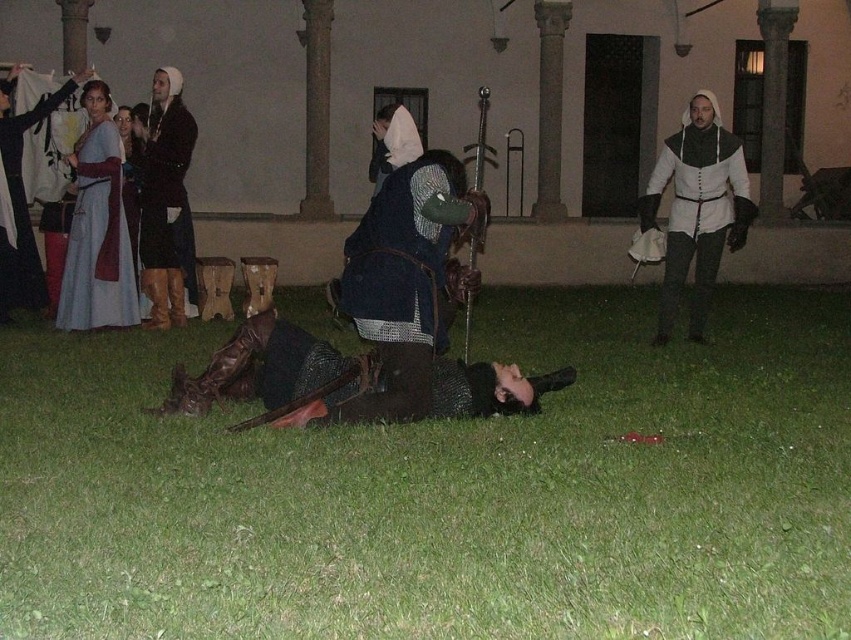
Who is positioned more to the left, white matte armor at center or matte black dress at upper left?

matte black dress at upper left is more to the left.

Is white matte armor at center taller than matte black dress at upper left?

No.

Who is more forward, (701, 276) or (20, 204)?

Point (701, 276) is in front.

Where is `white matte armor at center`? Image resolution: width=851 pixels, height=640 pixels. white matte armor at center is located at coordinates (697, 209).

The image size is (851, 640). What do you see at coordinates (96, 227) in the screenshot?
I see `matte blue dress at upper left` at bounding box center [96, 227].

Can you confirm if matte blue dress at upper left is bigger than matte black tunic at upper left?

Yes.

The image size is (851, 640). Describe the element at coordinates (96, 227) in the screenshot. I see `matte blue dress at upper left` at that location.

Locate an element on the screen. matte blue dress at upper left is located at coordinates click(x=96, y=227).

Is point (196, 381) more distant than point (426, 339)?

Yes, point (196, 381) is behind point (426, 339).

The image size is (851, 640). What do you see at coordinates (351, 380) in the screenshot?
I see `metallic chainmail helmet at center` at bounding box center [351, 380].

Is point (261, 323) more distant than point (374, 262)?

Yes, it is behind point (374, 262).

Image resolution: width=851 pixels, height=640 pixels. I want to click on metallic chainmail helmet at center, so click(351, 380).